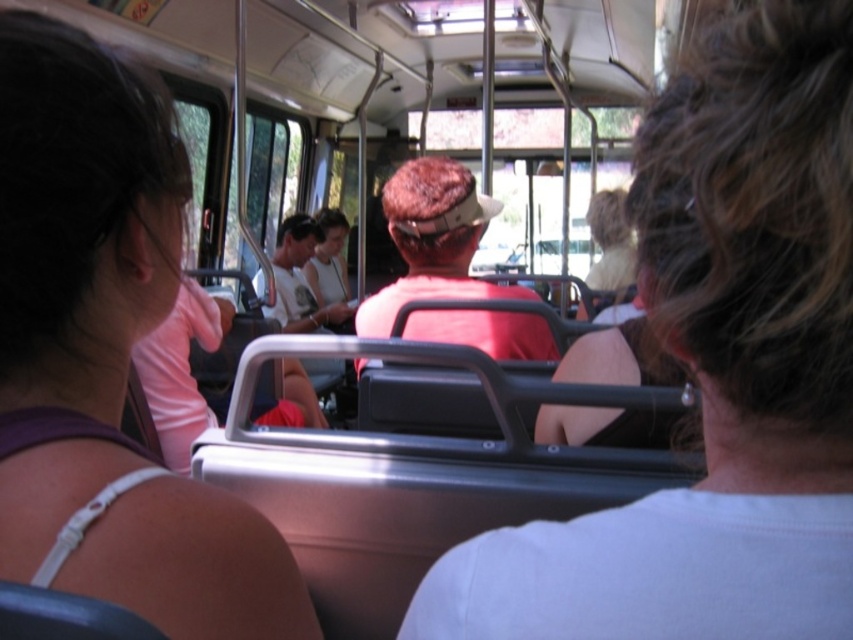
Which is more to the right, purple fabric shirt at upper left or matte red shirt at center?

matte red shirt at center is more to the right.

At what (x,y) coordinates should I click in order to perform the action: click on purple fabric shirt at upper left. Please return your answer as a coordinate pair (x, y). The width and height of the screenshot is (853, 640). Looking at the image, I should click on (74, 268).

Which is behind, point (699, 195) or point (74, 177)?

Point (74, 177)

Does white matte hair at upper right appear over purple fabric shirt at upper left?

Actually, white matte hair at upper right is below purple fabric shirt at upper left.

Which is behind, point (776, 360) or point (97, 276)?

The point (97, 276) is more distant.

This screenshot has width=853, height=640. Identify the location of white matte hair at upper right. (712, 369).

Does white matte hair at upper right appear under matte red shirt at center?

Correct, white matte hair at upper right is located below matte red shirt at center.

Which is above, white matte hair at upper right or matte red shirt at center?

matte red shirt at center

Does point (538, 584) lie in front of point (468, 250)?

Yes, it is.

Find the location of a particular element. The width and height of the screenshot is (853, 640). white matte hair at upper right is located at coordinates (712, 369).